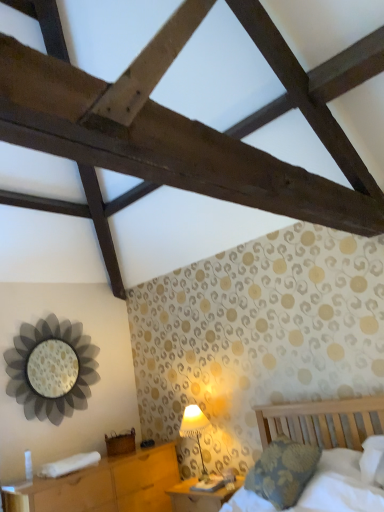
Question: From the image's perspective, is wooden bed at lower right positioned above or below wooden nightstand at lower center, which ranks as the 1th nightstand in right-to-left order?

Choices:
 (A) above
 (B) below

Answer: (A)

Question: From a real-world perspective, is wooden bed at lower right above or below wooden nightstand at lower center, which ranks as the 1th nightstand in right-to-left order?

Choices:
 (A) above
 (B) below

Answer: (A)

Question: Which is nearer to the white fabric lampshade at lower center?

Choices:
 (A) metallic flower-shaped mirror at left
 (B) wooden nightstand at lower center, positioned as the 2th nightstand in left-to-right order
 (C) wooden nightstand at lower left, which appears as the first nightstand when viewed from the left
 (D) wooden bed at lower right

Answer: (B)

Question: Which is farther from the metallic flower-shaped mirror at left?

Choices:
 (A) wooden bed at lower right
 (B) white fabric lampshade at lower center
 (C) wooden nightstand at lower left, the 2th nightstand when ordered from right to left
 (D) wooden nightstand at lower center, which ranks as the 1th nightstand in right-to-left order

Answer: (A)